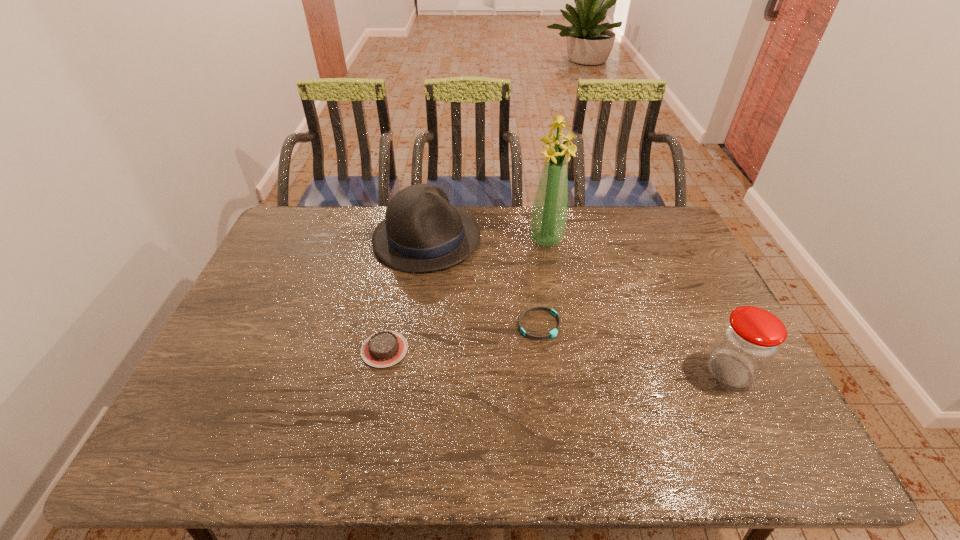
You are a GUI agent. You are given a task and a screenshot of the screen. Output one action in this format:
    pyautogui.click(x=<x>, y=<y>)
    Task: Click on the object that is at the near right corner
    
    Given the screenshot: What is the action you would take?
    pyautogui.click(x=749, y=340)

I want to click on free space at the far edge, so click(x=479, y=215).

I want to click on vacant position at the near edge of the desktop, so click(x=370, y=394).

This screenshot has height=540, width=960. I want to click on free space at the left edge, so click(238, 346).

You are a GUI agent. You are given a task and a screenshot of the screen. Output one action in this format:
    pyautogui.click(x=<x>, y=<y>)
    Task: Click on the vacant space at the right edge
    This screenshot has width=960, height=540.
    Given the screenshot: What is the action you would take?
    pyautogui.click(x=660, y=281)

Where is `free space at the far left corner of the desktop`? The height and width of the screenshot is (540, 960). free space at the far left corner of the desktop is located at coordinates (287, 234).

Locate an element on the screen. The height and width of the screenshot is (540, 960). vacant space at the near left corner of the desktop is located at coordinates (224, 419).

The height and width of the screenshot is (540, 960). In order to click on vacant position at the far right corner of the desktop in this screenshot , I will do `click(671, 226)`.

Where is `vacant space at the near right corner`? vacant space at the near right corner is located at coordinates (710, 403).

Locate an element on the screen. This screenshot has height=540, width=960. free spot between the second shortest object and the rightmost object is located at coordinates (557, 360).